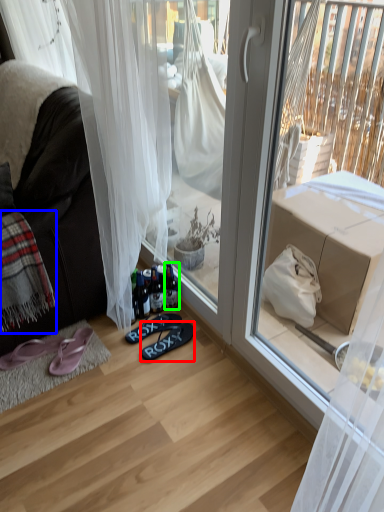
Question: Which object is the closest to the footwear (highlighted by a red box)? Choose among these: blanket (highlighted by a blue box) or bottle (highlighted by a green box).

Choices:
 (A) blanket
 (B) bottle

Answer: (B)